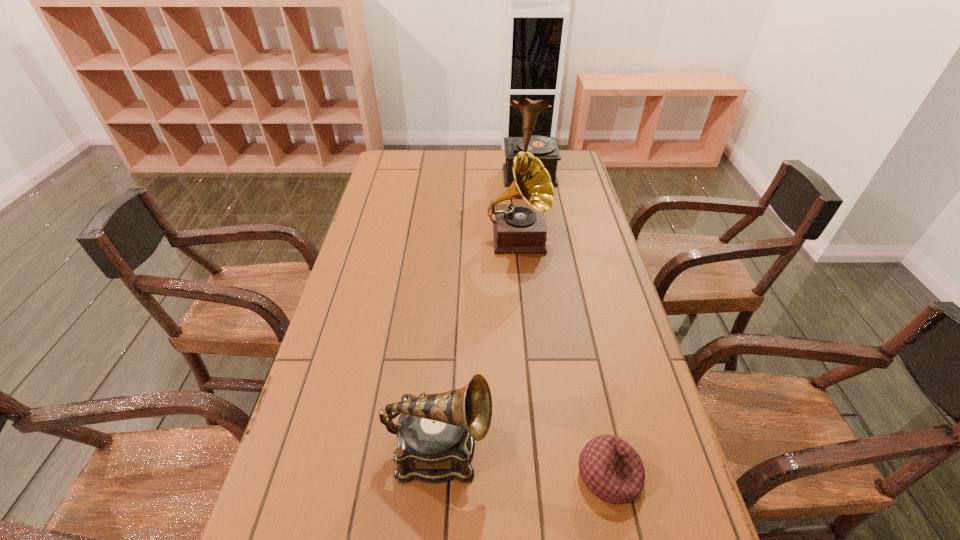
The image size is (960, 540). Find the location of `vacant space that satisfies the following two spatial constraints: 1. at the horn opening of the farthest phonograph record; 2. on the horn of the leftmost phonograph record`. vacant space that satisfies the following two spatial constraints: 1. at the horn opening of the farthest phonograph record; 2. on the horn of the leftmost phonograph record is located at coordinates (572, 449).